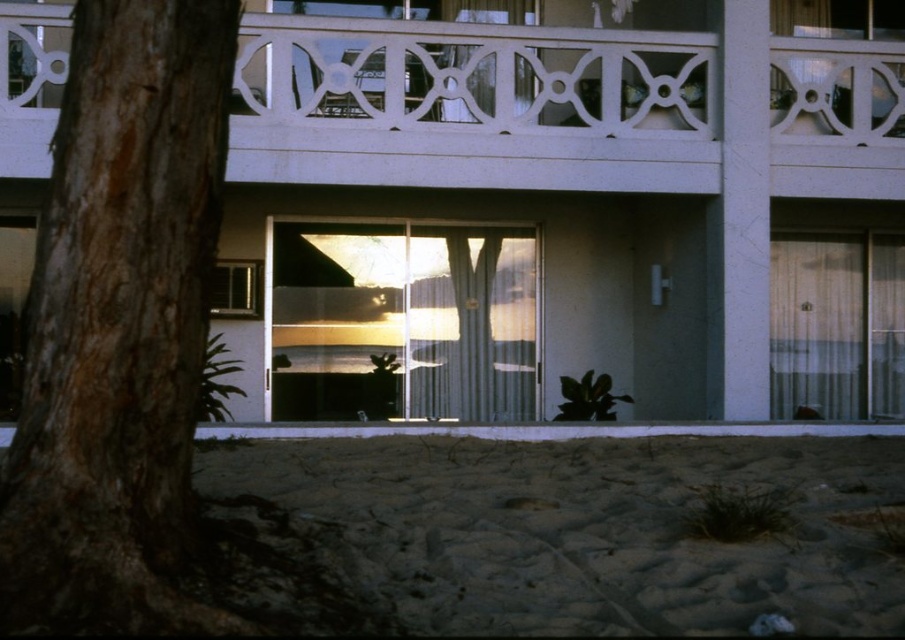
Question: Is white textured balcony at upper center above translucent glass door at right?

Choices:
 (A) yes
 (B) no

Answer: (A)

Question: In this image, where is white textured balcony at upper center located relative to transparent glass door at center?

Choices:
 (A) right
 (B) left

Answer: (A)

Question: Estimate the real-world distances between objects in this image. Which object is closer to the clear glass window at center?

Choices:
 (A) brown sandy beach at lower center
 (B) white textured balcony at upper center
 (C) clear glass window at upper center

Answer: (B)

Question: Observing the image, what is the correct spatial positioning of translucent glass door at right in reference to clear glass window at center?

Choices:
 (A) right
 (B) left

Answer: (A)

Question: Which point is closer to the camera?

Choices:
 (A) clear glass window at center
 (B) translucent glass door at right
 (C) brown rough bark tree at left
 (D) clear glass window at upper center

Answer: (C)

Question: Which object is farther from the camera taking this photo?

Choices:
 (A) transparent glass door at center
 (B) clear glass window at center
 (C) white textured balcony at upper center
 (D) clear glass window at upper center

Answer: (A)